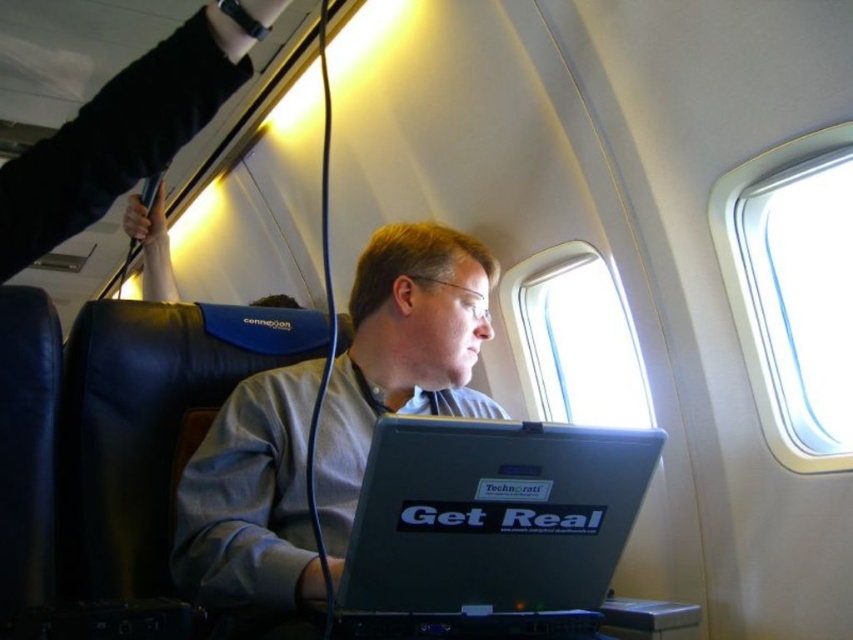
Question: Does silver/black plastic laptop at center have a greater width compared to transparent glass airplane window at center?

Choices:
 (A) yes
 (B) no

Answer: (B)

Question: Where is clear plastic airplane window at upper right located in relation to transparent glass airplane window at center in the image?

Choices:
 (A) above
 (B) below

Answer: (A)

Question: Which of the following is the closest to the observer?

Choices:
 (A) silver/black plastic laptop at center
 (B) transparent glass airplane window at center

Answer: (A)

Question: Does gray matte shirt at center have a smaller size compared to transparent glass airplane window at center?

Choices:
 (A) yes
 (B) no

Answer: (A)

Question: Which of the following is the farthest from the observer?

Choices:
 (A) (456, 257)
 (B) (579, 516)
 (C) (595, 253)

Answer: (C)

Question: Which point is farther to the camera?

Choices:
 (A) clear plastic airplane window at upper right
 (B) gray matte shirt at center
 (C) silver/black plastic laptop at center

Answer: (A)